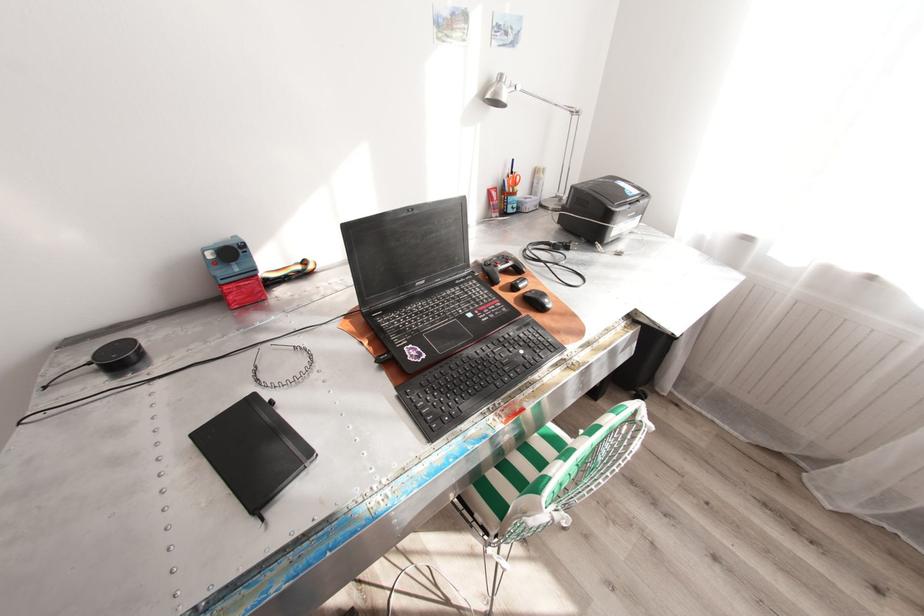
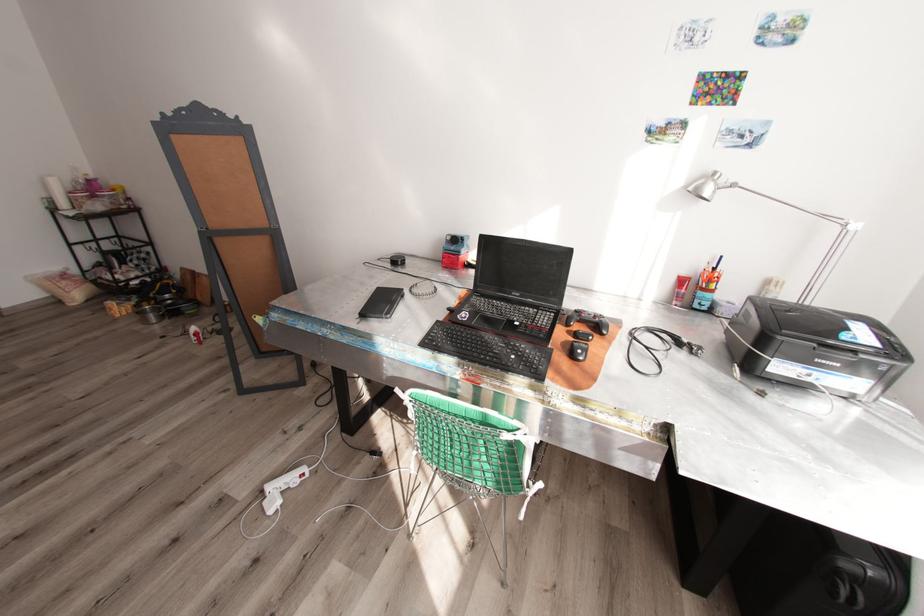
Where in the second image is the point corresponding to point 541,172 from the first image?

(772, 282)